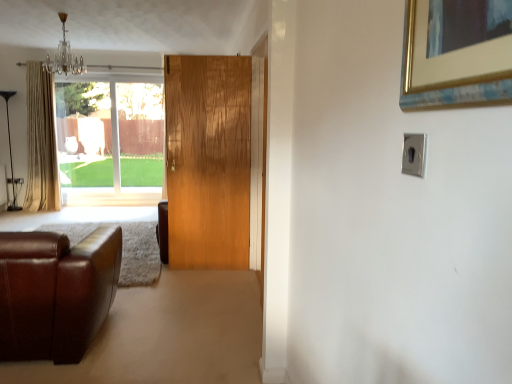
Question: Is clear glass window at upper left touching beige fabric curtain at left?

Choices:
 (A) no
 (B) yes

Answer: (A)

Question: Can you confirm if clear glass window at upper left is positioned to the right of beige fabric curtain at left?

Choices:
 (A) yes
 (B) no

Answer: (A)

Question: From the image's perspective, is clear glass window at upper left above beige fabric curtain at left?

Choices:
 (A) yes
 (B) no

Answer: (B)

Question: Does clear glass window at upper left have a lesser height compared to beige fabric curtain at left?

Choices:
 (A) no
 (B) yes

Answer: (B)

Question: Considering the relative sizes of clear glass window at upper left and beige fabric curtain at left in the image provided, is clear glass window at upper left wider than beige fabric curtain at left?

Choices:
 (A) no
 (B) yes

Answer: (A)

Question: Is clear glass window at upper left smaller than beige fabric curtain at left?

Choices:
 (A) no
 (B) yes

Answer: (B)

Question: Can you confirm if brown leather couch at lower left is shorter than beige fabric curtain at left?

Choices:
 (A) no
 (B) yes

Answer: (B)

Question: From a real-world perspective, is brown leather couch at lower left on top of beige fabric curtain at left?

Choices:
 (A) no
 (B) yes

Answer: (A)

Question: Is brown leather couch at lower left bigger than beige fabric curtain at left?

Choices:
 (A) no
 (B) yes

Answer: (B)

Question: Considering the relative positions of brown leather couch at lower left and beige fabric curtain at left in the image provided, is brown leather couch at lower left to the right of beige fabric curtain at left from the viewer's perspective?

Choices:
 (A) no
 (B) yes

Answer: (B)

Question: Is brown leather couch at lower left completely or partially outside of beige fabric curtain at left?

Choices:
 (A) yes
 (B) no

Answer: (A)

Question: Does brown leather couch at lower left have a smaller size compared to beige fabric curtain at left?

Choices:
 (A) no
 (B) yes

Answer: (A)

Question: Is beige fabric curtain at left located outside brown leather couch at lower left?

Choices:
 (A) no
 (B) yes

Answer: (B)